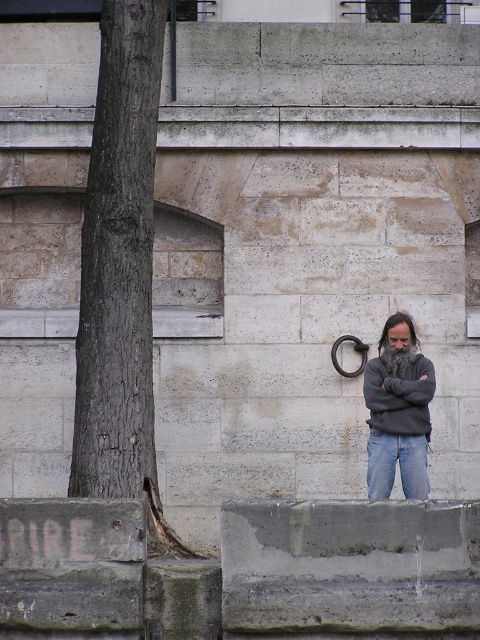
Question: Can you confirm if gray sweater at center is wider than denim jeans at lower center?

Choices:
 (A) no
 (B) yes

Answer: (B)

Question: Among these points, which one is nearest to the camera?

Choices:
 (A) (405, 353)
 (B) (408, 384)

Answer: (B)

Question: Is brown rough bark tree at left positioned at the back of dark gray sweater at center?

Choices:
 (A) yes
 (B) no

Answer: (B)

Question: Does gray sweater at center have a larger size compared to denim jeans at lower center?

Choices:
 (A) yes
 (B) no

Answer: (A)

Question: Estimate the real-world distances between objects in this image. Which object is closer to the brown rough bark tree at left?

Choices:
 (A) gray sweater at center
 (B) dark gray sweater at center
 (C) denim jeans at lower center

Answer: (B)

Question: Which of the following is the closest to the observer?

Choices:
 (A) (151, 465)
 (B) (405, 410)

Answer: (A)